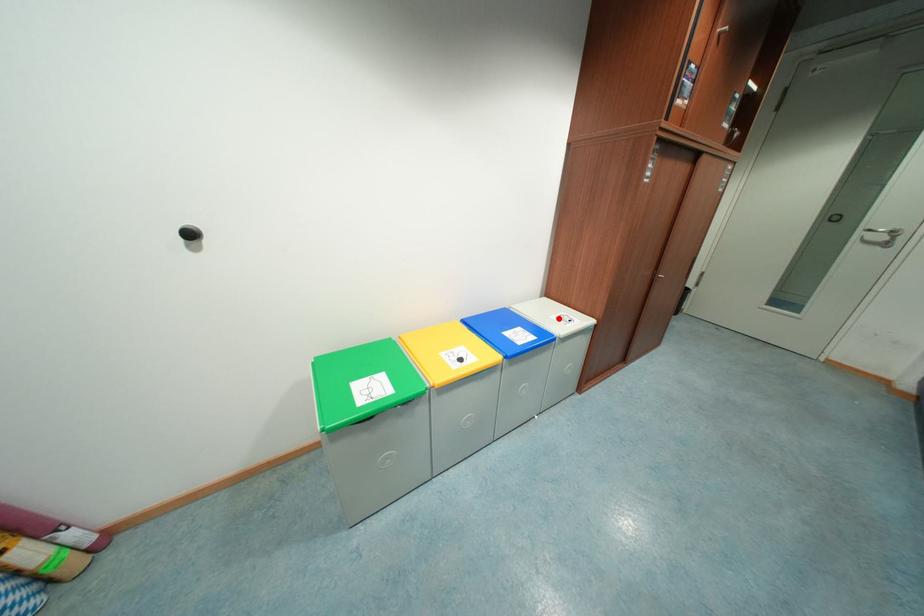
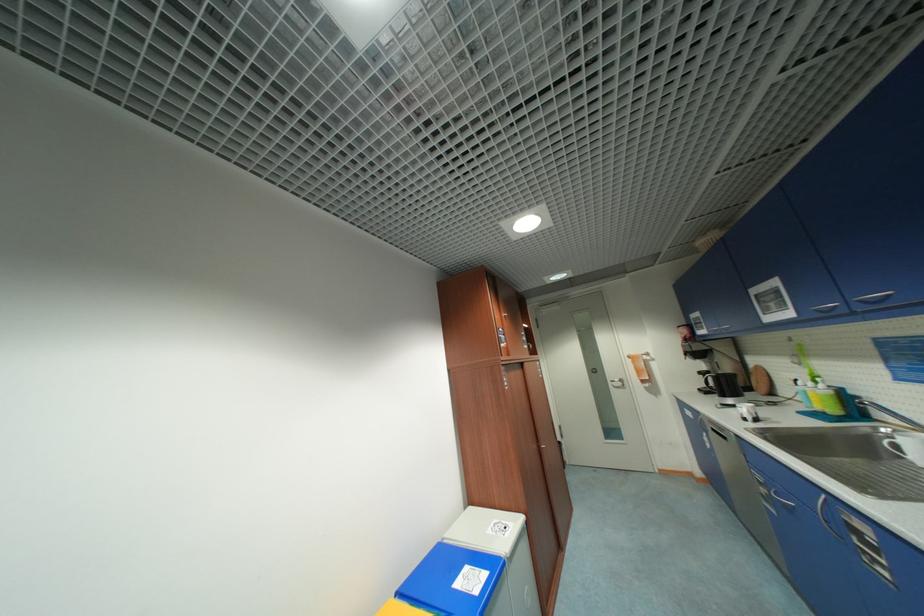
Where in the second image is the point corresponding to the highlighted location from the first image?

(495, 533)